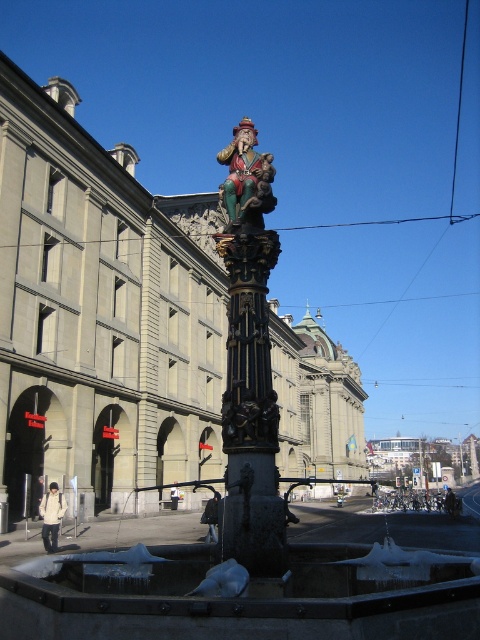
Question: Can you confirm if polished bronze column at center is positioned to the right of polychrome wood figure at center?

Choices:
 (A) no
 (B) yes

Answer: (B)

Question: Is polished bronze column at center positioned before polychrome wood figure at center?

Choices:
 (A) yes
 (B) no

Answer: (A)

Question: Is polished bronze column at center smaller than polychrome wood figure at center?

Choices:
 (A) yes
 (B) no

Answer: (A)

Question: Which point is farther to the camera?

Choices:
 (A) (268, 513)
 (B) (247, 125)

Answer: (B)